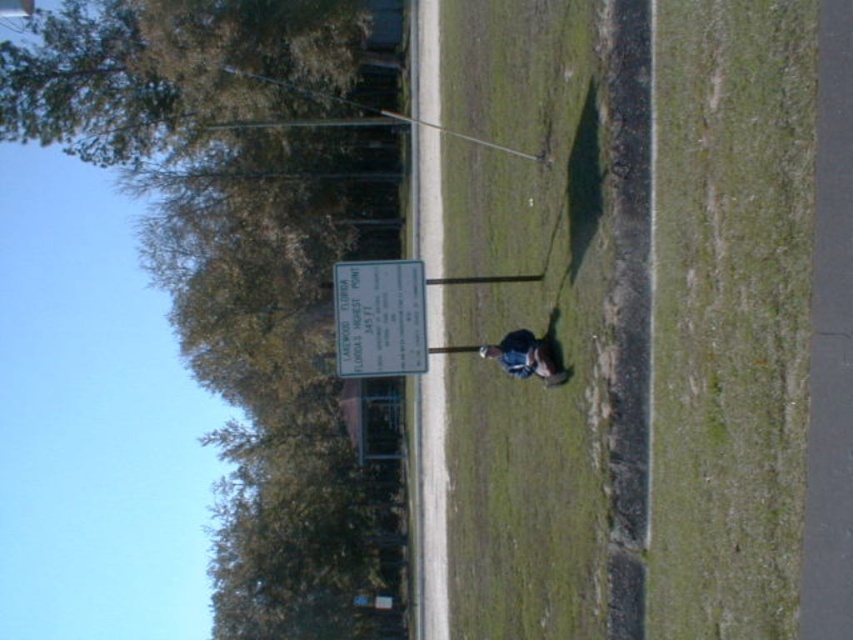
Question: Is green leafy tree at upper left wider than green grass at center?

Choices:
 (A) yes
 (B) no

Answer: (A)

Question: Which of the following is the farthest from the observer?

Choices:
 (A) (590, 404)
 (B) (398, 362)
 (C) (531, 337)
 (D) (184, 182)

Answer: (D)

Question: Can you confirm if green grass at center is positioned to the left of white plastic sign at center?

Choices:
 (A) yes
 (B) no

Answer: (B)

Question: Among these objects, which one is nearest to the camera?

Choices:
 (A) white plastic sign at center
 (B) dark blue denim jacket at center
 (C) green grass at center
 (D) green leafy tree at upper left

Answer: (C)

Question: Is green leafy tree at upper left positioned in front of green grass at center?

Choices:
 (A) yes
 (B) no

Answer: (B)

Question: Which object is the closest to the dark blue denim jacket at center?

Choices:
 (A) white plastic sign at center
 (B) green leafy tree at upper left

Answer: (A)